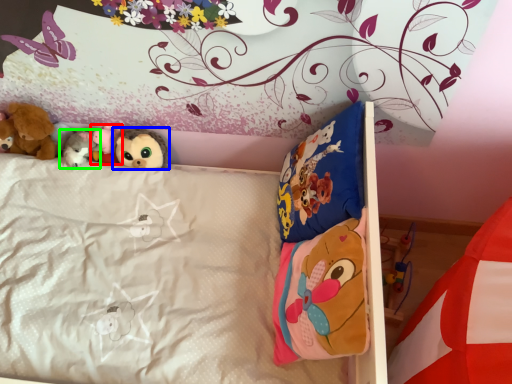
Question: Considering the real-world distances, which object is farthest from toy (highlighted by a red box)? toy (highlighted by a blue box) or toy (highlighted by a green box)?

Choices:
 (A) toy
 (B) toy

Answer: (A)